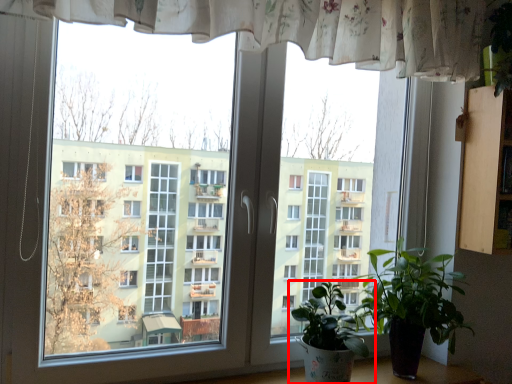
Question: From the image's perspective, where is houseplant (annotated by the red box) located relative to houseplant?

Choices:
 (A) above
 (B) below

Answer: (B)